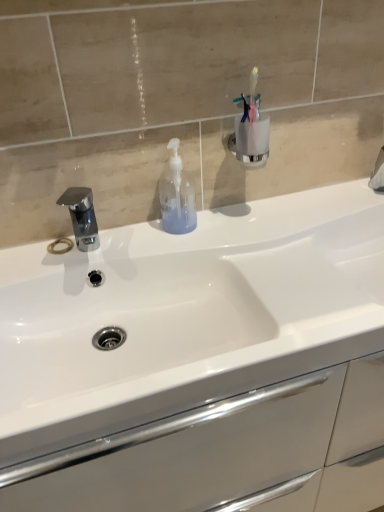
Question: Looking at their shapes, would you say translucent plastic soap dispenser at center is wider or thinner than white glossy sink at center?

Choices:
 (A) wide
 (B) thin

Answer: (B)

Question: In terms of size, does translucent plastic soap dispenser at center appear bigger or smaller than white glossy sink at center?

Choices:
 (A) big
 (B) small

Answer: (B)

Question: Considering the real-world distances, which object is closest to the chrome metallic faucet at left?

Choices:
 (A) translucent plastic soap dispenser at center
 (B) white glossy sink at center

Answer: (A)

Question: Based on their relative distances, which object is farther from the white glossy sink at center?

Choices:
 (A) translucent plastic soap dispenser at center
 (B) chrome metallic faucet at left

Answer: (B)